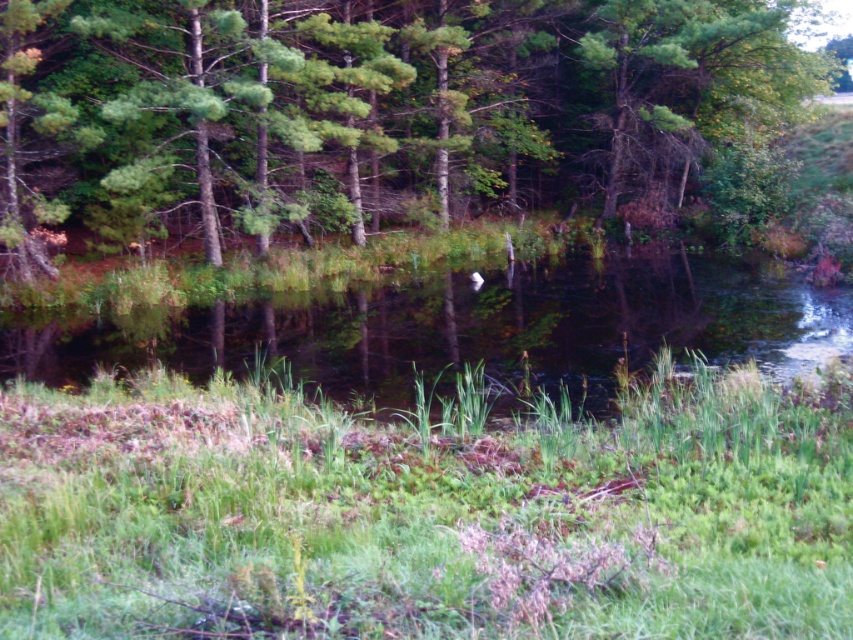
Can you confirm if green leafy tree at center is taller than green grassy water at center?

Yes.

Does green leafy tree at center appear on the left side of green grassy water at center?

Incorrect, green leafy tree at center is not on the left side of green grassy water at center.

Is point (576, 200) farther from viewer compared to point (751, 284)?

Yes, it is behind point (751, 284).

Find the location of a particular element. The width and height of the screenshot is (853, 640). green leafy tree at center is located at coordinates (381, 109).